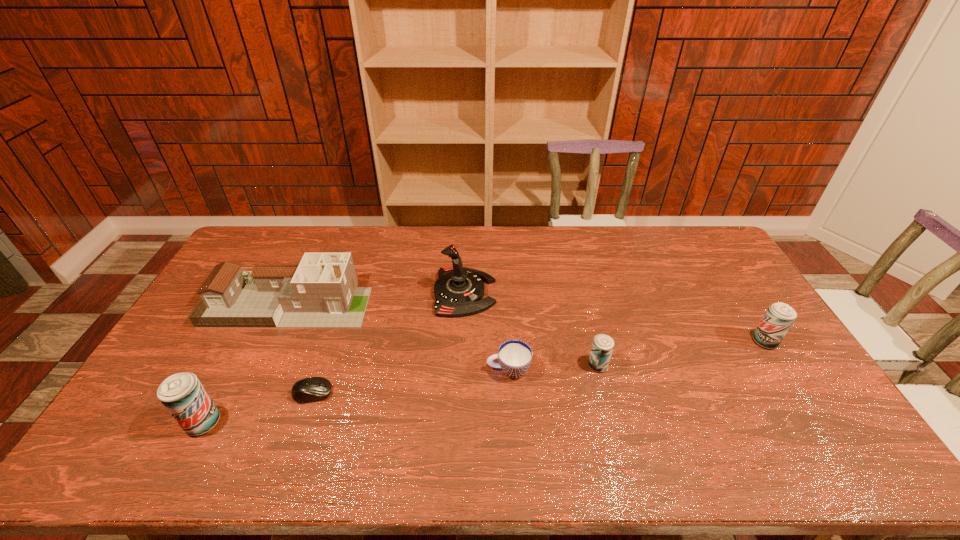
Where is `location for an additional beer_can to make spacing equal`? location for an additional beer_can to make spacing equal is located at coordinates (412, 393).